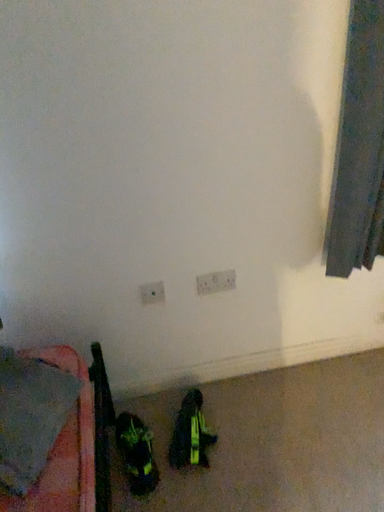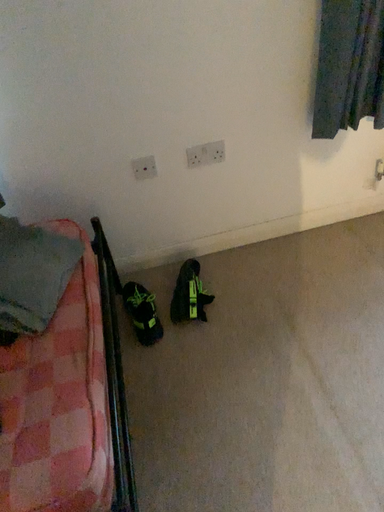
Question: Which way did the camera rotate in the video?

Choices:
 (A) rotated downward
 (B) rotated upward

Answer: (A)